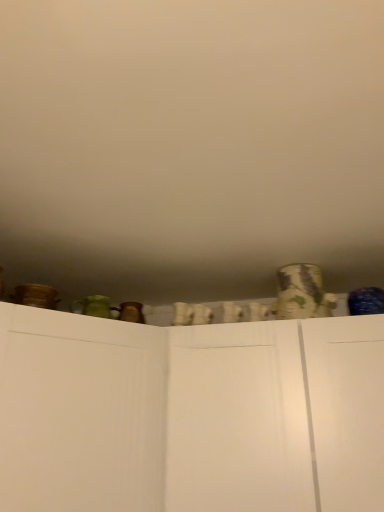
Locate an element on the screen. white matte cupboard at center is located at coordinates (190, 415).

Identify the location of white matte wall at upper center. (190, 145).

What do you see at coordinates (302, 293) in the screenshot? The height and width of the screenshot is (512, 384). I see `patterned ceramic vase at upper right` at bounding box center [302, 293].

The height and width of the screenshot is (512, 384). Find the location of `white matte cupboard at center`. white matte cupboard at center is located at coordinates (190, 415).

Is point (353, 428) farther from viewer compared to point (322, 311)?

That is False.

Is white matte cupboard at center aimed at patterned ceramic vase at upper right?

No.

Locate an element on the screen. cupboard below the patterned ceramic vase at upper right (from the image's perspective) is located at coordinates (190, 415).

Which of these two, white matte cupboard at center or patterned ceramic vase at upper right, is bigger?

white matte cupboard at center.

From the image's perspective, is patterned ceramic vase at upper right above white matte wall at upper center?

No, from the image's perspective, patterned ceramic vase at upper right is not over white matte wall at upper center.

How many degrees apart are the facing directions of patterned ceramic vase at upper right and white matte wall at upper center?

88.1 degrees.

Can you confirm if patterned ceramic vase at upper right is wider than white matte wall at upper center?

No.

Between patterned ceramic vase at upper right and white matte wall at upper center, which one has larger size?

With larger size is white matte wall at upper center.

Based on the photo, from the image's perspective, is patterned ceramic vase at upper right above white matte cupboard at center?

Correct, patterned ceramic vase at upper right appears higher than white matte cupboard at center in the image.

Is patterned ceramic vase at upper right smaller than white matte cupboard at center?

Yes, patterned ceramic vase at upper right is smaller than white matte cupboard at center.

Is patterned ceramic vase at upper right surrounding white matte cupboard at center?

No, white matte cupboard at center is not surrounded by patterned ceramic vase at upper right.

Is the position of white matte wall at upper center more distant than that of white matte cupboard at center?

No.

Is white matte wall at upper center thinner than white matte cupboard at center?

No.

Is white matte wall at upper center directly adjacent to white matte cupboard at center?

There is a gap between white matte wall at upper center and white matte cupboard at center.

The width and height of the screenshot is (384, 512). In order to click on backdrop on the left of the white matte cupboard at center in this screenshot , I will do `click(190, 145)`.

Consider the image. Considering the relative sizes of white matte cupboard at center and white matte wall at upper center in the image provided, is white matte cupboard at center taller than white matte wall at upper center?

Yes.

Does point (227, 358) come in front of point (50, 275)?

Yes, it is.

Which is more distant, [187,179] or [299,267]?

The point [299,267] is more distant.

Is white matte wall at upper center inside the boundaries of patterned ceramic vase at upper right, or outside?

white matte wall at upper center is located beyond the bounds of patterned ceramic vase at upper right.

Is white matte wall at upper center shorter than patterned ceramic vase at upper right?

Indeed, white matte wall at upper center has a lesser height compared to patterned ceramic vase at upper right.

Could you tell me if white matte wall at upper center is facing patterned ceramic vase at upper right?

No, white matte wall at upper center does not turn towards patterned ceramic vase at upper right.

Where is `cupboard on the left of patterned ceramic vase at upper right`? The width and height of the screenshot is (384, 512). cupboard on the left of patterned ceramic vase at upper right is located at coordinates (190, 415).

I want to click on pottery lying behind the white matte wall at upper center, so click(302, 293).

Based on their spatial positions, is patterned ceramic vase at upper right or white matte cupboard at center further from white matte wall at upper center?

Among the two, patterned ceramic vase at upper right is located further to white matte wall at upper center.

Considering their positions, is white matte cupboard at center positioned further to white matte wall at upper center than patterned ceramic vase at upper right?

Based on the image, patterned ceramic vase at upper right appears to be further to white matte wall at upper center.

From the image, which object appears to be nearer to white matte cupboard at center, white matte wall at upper center or patterned ceramic vase at upper right?

patterned ceramic vase at upper right lies closer to white matte cupboard at center than the other object.

When comparing their distances from patterned ceramic vase at upper right, does white matte wall at upper center or white matte cupboard at center seem closer?

Among the two, white matte cupboard at center is located nearer to patterned ceramic vase at upper right.

Based on their spatial positions, is patterned ceramic vase at upper right or white matte wall at upper center further from white matte cupboard at center?

Based on the image, white matte wall at upper center appears to be further to white matte cupboard at center.

When comparing their distances from patterned ceramic vase at upper right, does white matte cupboard at center or white matte wall at upper center seem further?

white matte wall at upper center is further to patterned ceramic vase at upper right.

Find the location of a particular element. Image resolution: width=384 pixels, height=512 pixels. cupboard between white matte wall at upper center and patterned ceramic vase at upper right in the front-back direction is located at coordinates (190, 415).